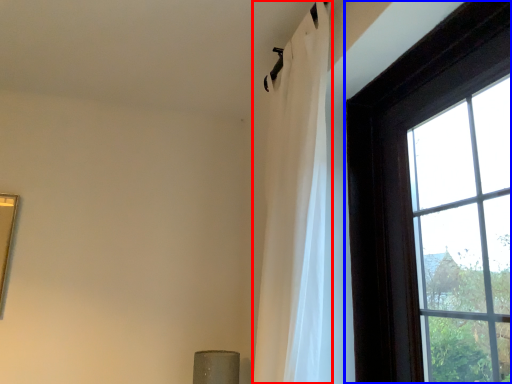
Question: Which point is further to the camera, curtain (highlighted by a red box) or window (highlighted by a blue box)?

Choices:
 (A) curtain
 (B) window

Answer: (A)